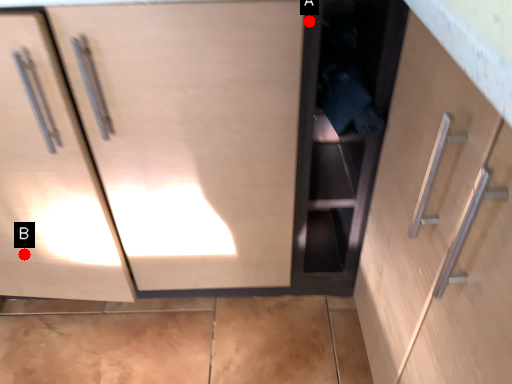
Question: Two points are circled on the image, labeled by A and B beside each circle. Among these points, which one is farthest from the camera?

Choices:
 (A) A is further
 (B) B is further

Answer: (B)